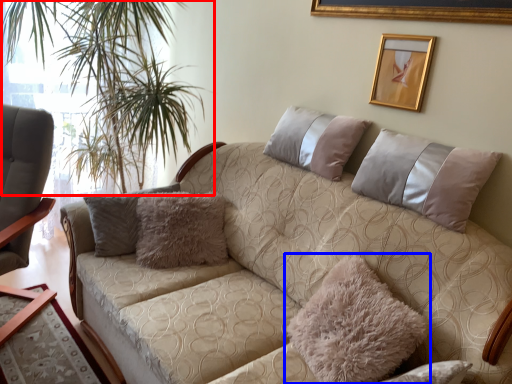
Question: Among these objects, which one is farthest to the camera, plant (highlighted by a red box) or pillow (highlighted by a blue box)?

Choices:
 (A) plant
 (B) pillow

Answer: (A)